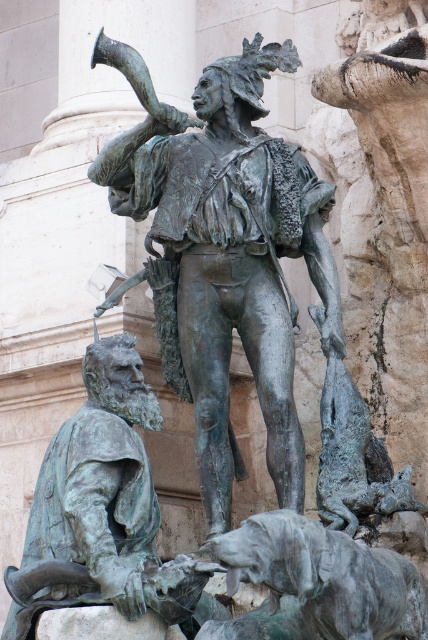
Is bronze statue at center further to the viewer compared to greenish patina dog at lower center?

That is True.

Is point (272, 336) in front of point (357, 570)?

No, (272, 336) is further to viewer.

At what (x,y) coordinates should I click in order to perform the action: click on bronze statue at center. Please return your answer as a coordinate pair (x, y). Looking at the image, I should click on (228, 250).